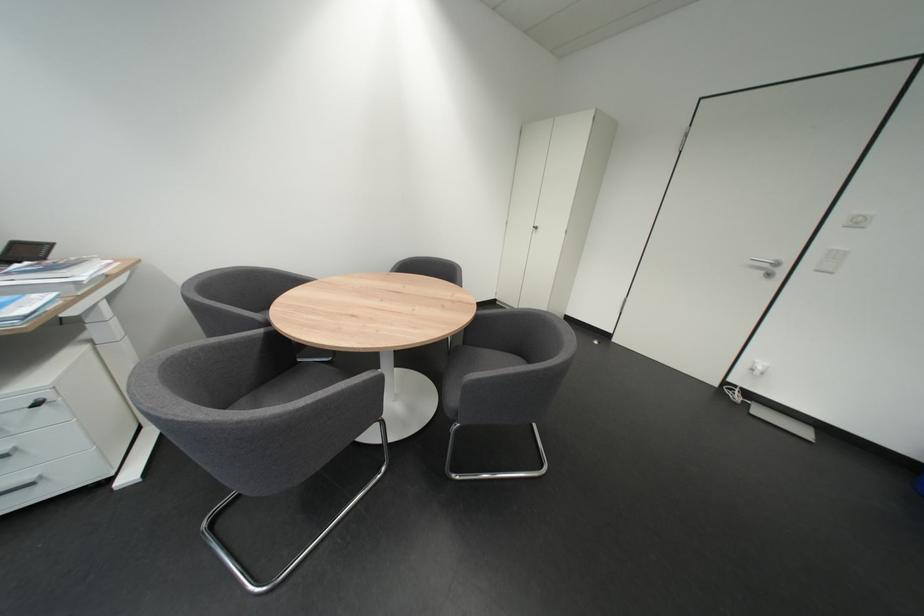
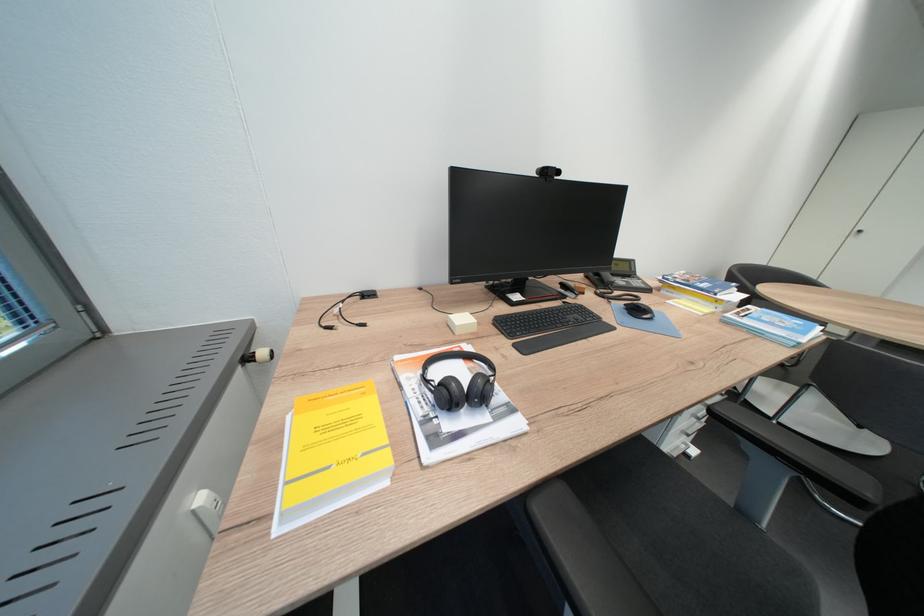
Question: What movement of the cameraman would produce the second image?

Choices:
 (A) Left
 (B) Right
 (C) Forward
 (D) Backward

Answer: (A)